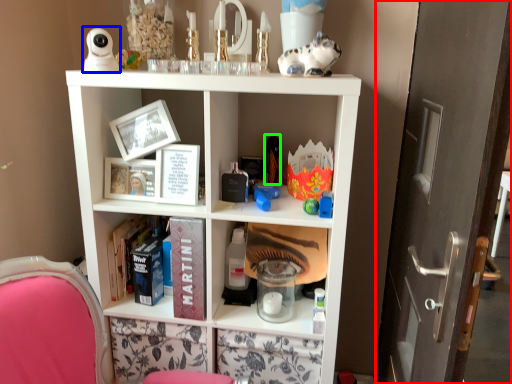
Question: Which is farther away from glass door (highlighted by a red box)? toy (highlighted by a blue box) or toy (highlighted by a green box)?

Choices:
 (A) toy
 (B) toy

Answer: (A)